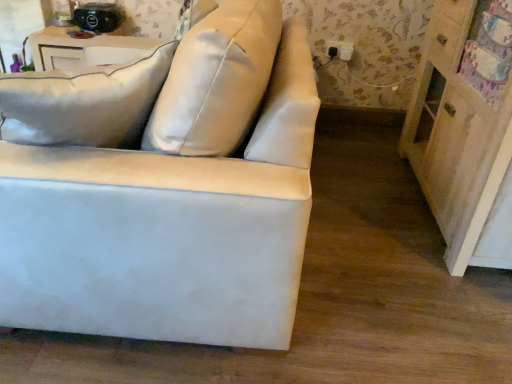
Question: Is white leather couch at center spatially inside wooden dresser at right, or outside of it?

Choices:
 (A) outside
 (B) inside

Answer: (A)

Question: Looking at their shapes, would you say white leather couch at center is wider or thinner than wooden dresser at right?

Choices:
 (A) thin
 (B) wide

Answer: (B)

Question: Which of these objects is positioned closest to the wooden dresser at right?

Choices:
 (A) white wood table at upper left
 (B) white leather couch at center
 (C) black plastic outlet at upper right

Answer: (B)

Question: Estimate the real-world distances between objects in this image. Which object is closer to the white leather couch at center?

Choices:
 (A) white wood table at upper left
 (B) wooden dresser at right
 (C) black plastic outlet at upper right

Answer: (B)